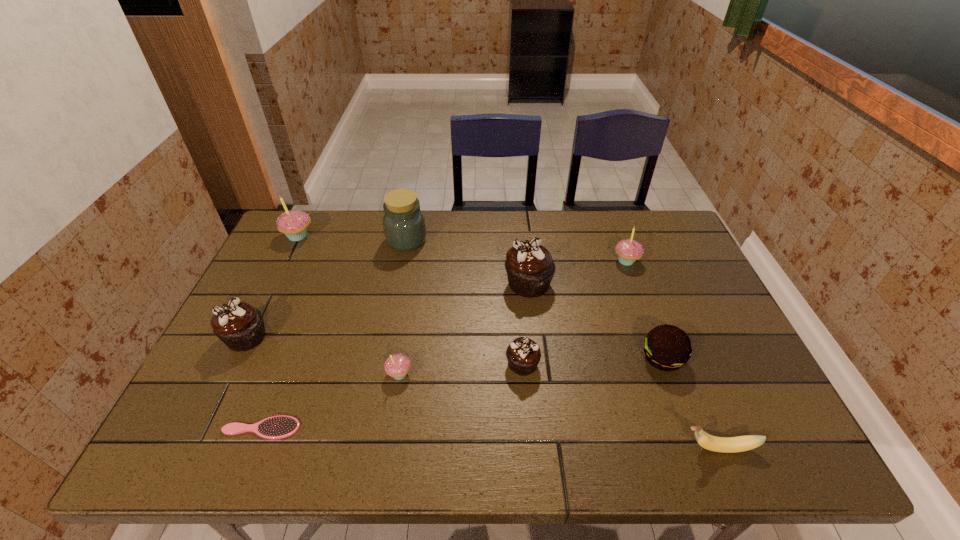
Identify the location of green jar. The width and height of the screenshot is (960, 540). (404, 226).

Find the location of a particular element. the farthest brown cupcake is located at coordinates (530, 268).

Find the location of `the biggest pink cupcake`. the biggest pink cupcake is located at coordinates (294, 223).

Where is `the leftmost pink cupcake`? Image resolution: width=960 pixels, height=540 pixels. the leftmost pink cupcake is located at coordinates (294, 223).

I want to click on the leftmost brown cupcake, so click(240, 326).

What are the coordinates of `the rightmost pink cupcake` in the screenshot? It's located at (628, 250).

Where is `the second nearest pink cupcake`? the second nearest pink cupcake is located at coordinates (628, 250).

The height and width of the screenshot is (540, 960). In order to click on patty in this screenshot , I will do `click(666, 347)`.

Find the location of `the second pink cupcake from right to left`. the second pink cupcake from right to left is located at coordinates (397, 366).

I want to click on the smallest pink cupcake, so click(397, 366).